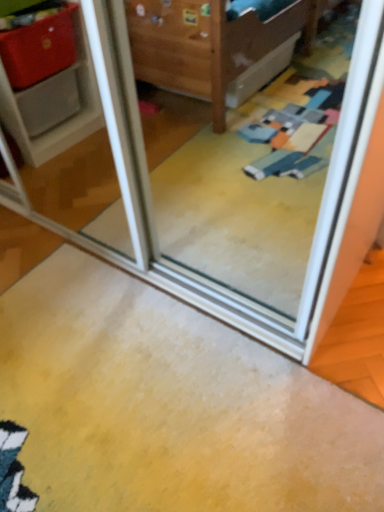
Locate an element on the screen. free region under transparent glass screen door at center (from a real-world perspective) is located at coordinates (155, 219).